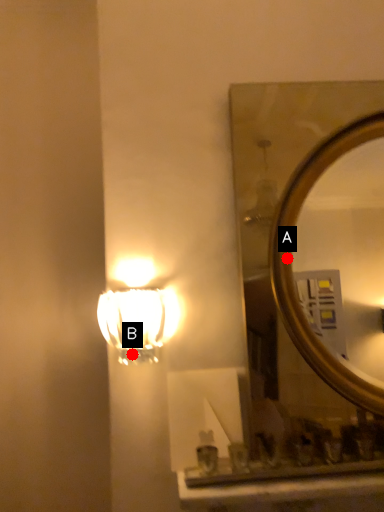
Question: Two points are circled on the image, labeled by A and B beside each circle. Which point appears farthest from the camera in this image?

Choices:
 (A) A is further
 (B) B is further

Answer: (B)